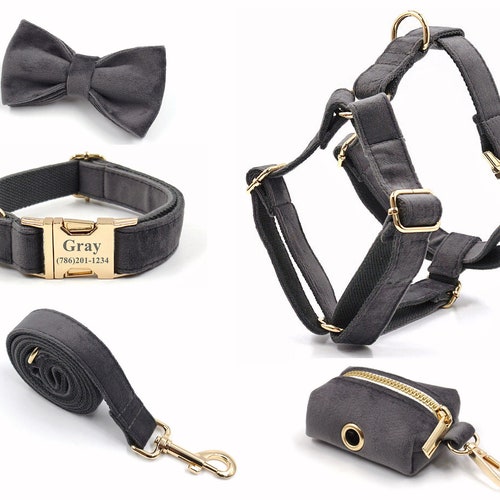
I want to click on rolled up fabric, so click(78, 382).